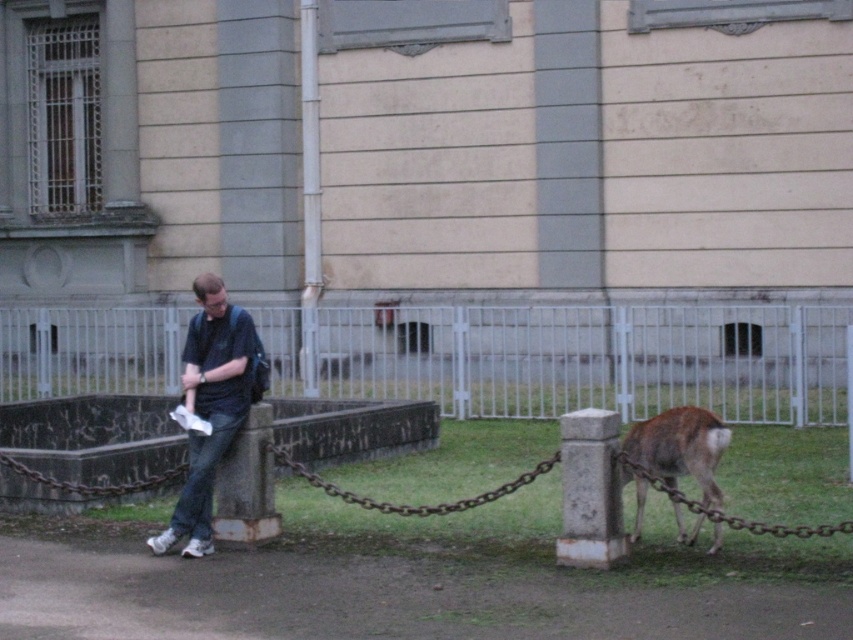
Question: Is white metal fence at center smaller than dark blue jeans at left?

Choices:
 (A) no
 (B) yes

Answer: (A)

Question: Does brown furry deer at lower right appear on the left side of rusty metal chain at lower right?

Choices:
 (A) yes
 (B) no

Answer: (A)

Question: Does brown furry deer at lower right appear under rusty metal chain at lower right?

Choices:
 (A) yes
 (B) no

Answer: (B)

Question: Which point appears closest to the camera in this image?

Choices:
 (A) (321, 480)
 (B) (636, 506)
 (C) (202, 332)
 (D) (10, 458)

Answer: (C)

Question: Estimate the real-world distances between objects in this image. Which object is closer to the rusty metal chain at center?

Choices:
 (A) brown furry deer at lower right
 (B) rusty metal chain at lower center

Answer: (A)

Question: Which point is closer to the camera?

Choices:
 (A) (715, 525)
 (B) (230, 314)
 (C) (624, 461)
 (D) (328, 490)

Answer: (C)